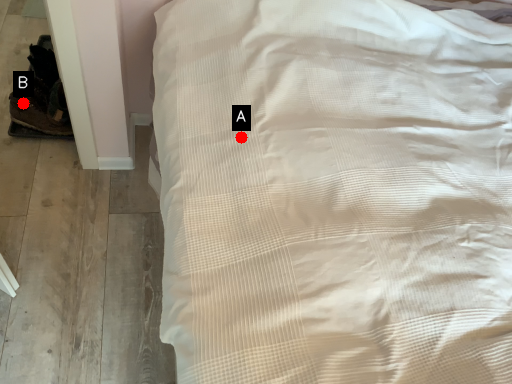
Question: Two points are circled on the image, labeled by A and B beside each circle. Which of the following is the farthest from the observer?

Choices:
 (A) A is further
 (B) B is further

Answer: (B)